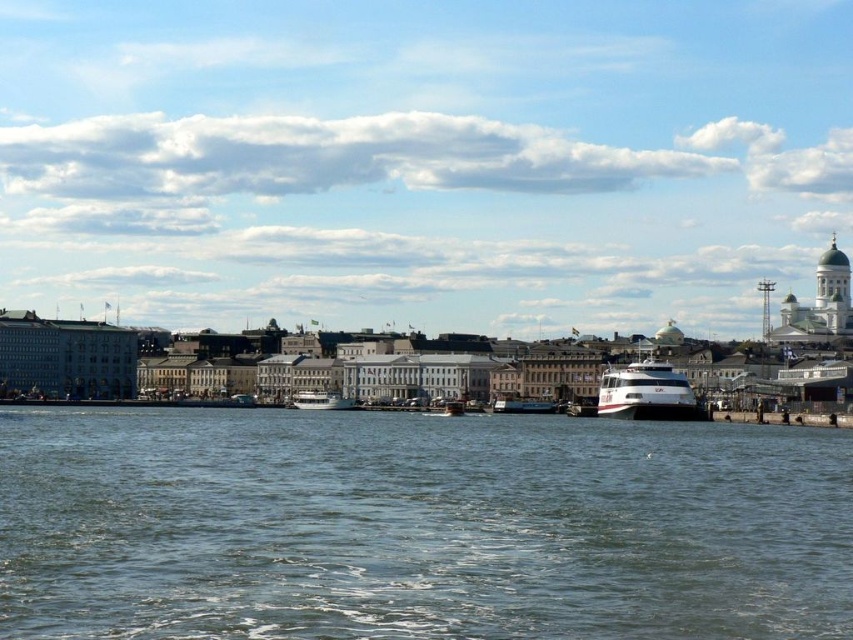
You are a tour guide leading a group on a sightseeing boat. You notice two boats in the water ahead. The white glossy ferry at center and the metallic blue boat at center. Your boat is 15 meters long. Can you safely pass between them without touching either?

The distance between the white glossy ferry at center and the metallic blue boat at center is 17.55 meters. Since your boat is 15 meters long, there is enough space to safely pass between them as the gap is wider than the boat.

You are a tourist standing on the waterfront and see the metallic blue boat at center and the white glossy boat at center. Which boat is closer to the right edge of the image?

The metallic blue boat at center is closer to the right edge of the image because it is positioned to the right of the white glossy boat at center.